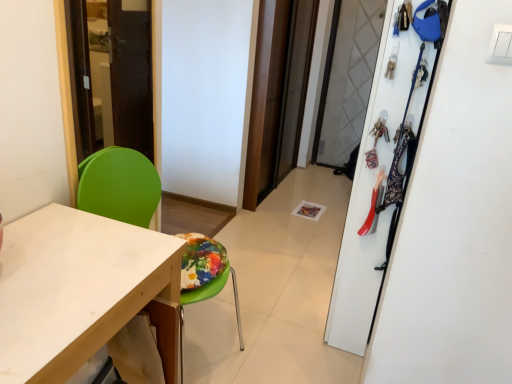
Image resolution: width=512 pixels, height=384 pixels. Identify the location of unoccupied region to the right of transparent glass screen door at center. (306, 192).